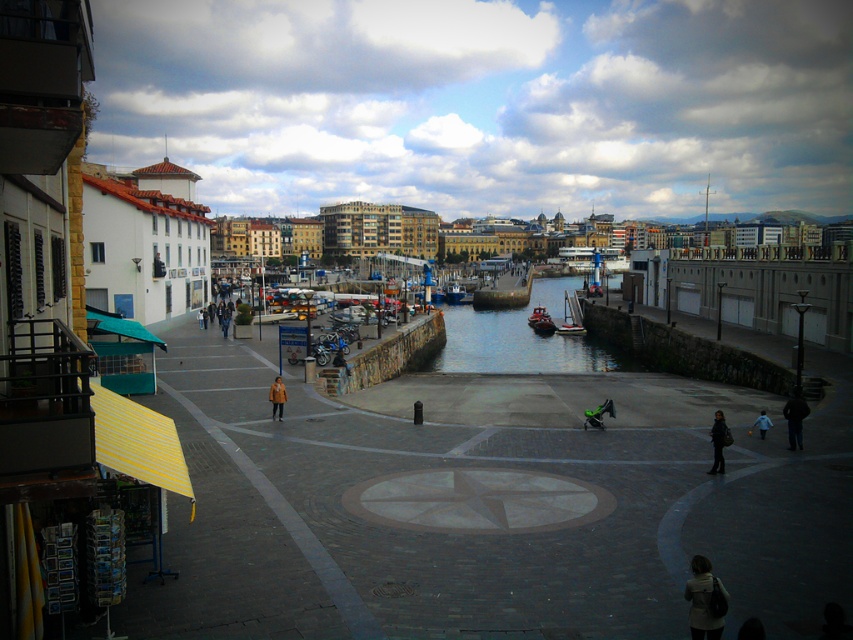
Does dark brown leather jacket at lower right appear on the right side of light blue denim jacket at lower right?

Indeed, dark brown leather jacket at lower right is positioned on the right side of light blue denim jacket at lower right.

Can you confirm if dark brown leather jacket at lower right is taller than light blue denim jacket at lower right?

Yes.

The width and height of the screenshot is (853, 640). I want to click on dark brown leather jacket at lower right, so click(x=795, y=417).

You are a GUI agent. You are given a task and a screenshot of the screen. Output one action in this format:
    pyautogui.click(x=<x>, y=<y>)
    Task: Click on the dark brown leather jacket at lower right
    This screenshot has width=853, height=640.
    Given the screenshot: What is the action you would take?
    pyautogui.click(x=795, y=417)

This screenshot has height=640, width=853. Describe the element at coordinates (795, 417) in the screenshot. I see `dark brown leather jacket at lower right` at that location.

Which is in front, point (802, 403) or point (721, 428)?

Positioned in front is point (721, 428).

Who is more forward, (x=782, y=413) or (x=715, y=426)?

Point (x=715, y=426) is in front.

Where is `dark brown leather jacket at lower right`? This screenshot has width=853, height=640. dark brown leather jacket at lower right is located at coordinates (795, 417).

Does wooden boat at center have a smaller size compared to orange leather jacket at lower center?

No, wooden boat at center is not smaller than orange leather jacket at lower center.

Locate an element on the screen. The image size is (853, 640). wooden boat at center is located at coordinates (572, 316).

Between point (566, 310) and point (282, 392), which one is positioned behind?

Point (566, 310)

At what (x,y) coordinates should I click in order to perform the action: click on wooden boat at center. Please return your answer as a coordinate pair (x, y). The width and height of the screenshot is (853, 640). Looking at the image, I should click on (572, 316).